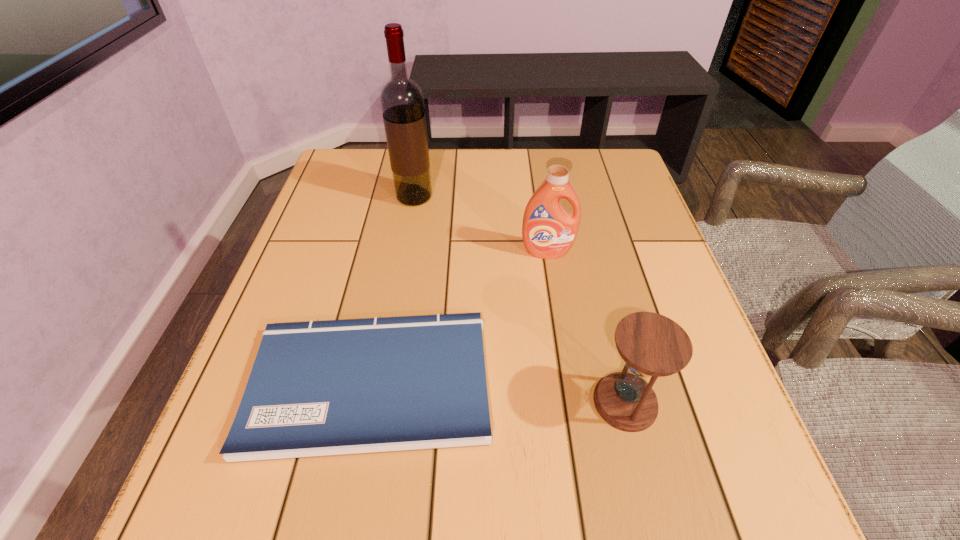
I want to click on wine bottle, so pyautogui.click(x=402, y=102).

Identify the location of the farthest object. (402, 102).

Where is `the third shortest object`? the third shortest object is located at coordinates (548, 230).

You are a GUI agent. You are given a task and a screenshot of the screen. Output one action in this format:
    pyautogui.click(x=<x>, y=<y>)
    Task: Click on the detergent
    
    Given the screenshot: What is the action you would take?
    pyautogui.click(x=548, y=230)

Image resolution: width=960 pixels, height=540 pixels. Identify the location of hourglass. (652, 345).

Find the location of a particular element. Image resolution: width=960 pixels, height=540 pixels. the shortest object is located at coordinates (320, 388).

Find the location of a particular element. Image resolution: width=960 pixels, height=540 pixels. vacant space located on the left of the farthest object is located at coordinates (327, 197).

Find the location of a particular element. The image size is (960, 540). free region located 0.100m on the front-facing side of the detergent is located at coordinates (553, 293).

Locate an element on the screen. Image resolution: width=960 pixels, height=540 pixels. free region located on the front of the third tallest object is located at coordinates (649, 498).

You are a GUI agent. You are given a task and a screenshot of the screen. Output one action in this format:
    pyautogui.click(x=<x>, y=<y>)
    Task: Click on the blank space located on the right of the shortest object
    The width and height of the screenshot is (960, 540).
    Given the screenshot: What is the action you would take?
    pyautogui.click(x=576, y=383)